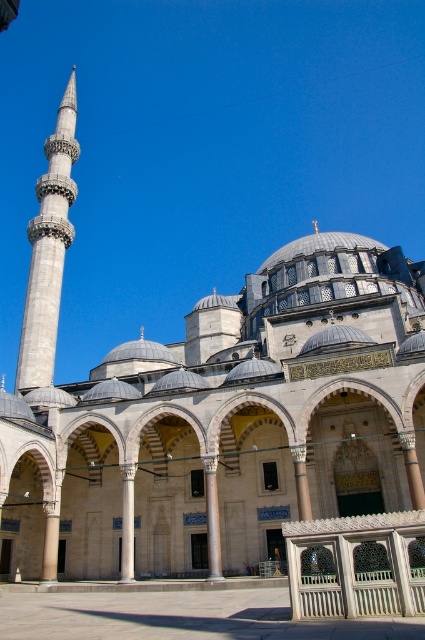
You are standing in front of the mosque and want to take a photo that includes both the gray stone minaret at left and the slate stone column at center. Which object should you position higher in your camera frame?

The gray stone minaret at left should be positioned higher in the camera frame because it is located above the slate stone column at center.

You are standing in front of the grand mosque and notice two columns at the center. Which one is closer to you, the slate stone column at center or the white marble pillar at center?

The slate stone column at center is closer to you because it is in front of the white marble pillar at center.

Based on the photo, you are an architect visiting the mosque and need to determine which column is larger between the slate stone column at center and the white marble pillar at center. Based on the scene, which one is larger?

The slate stone column at center is bigger than the white marble pillar at center.